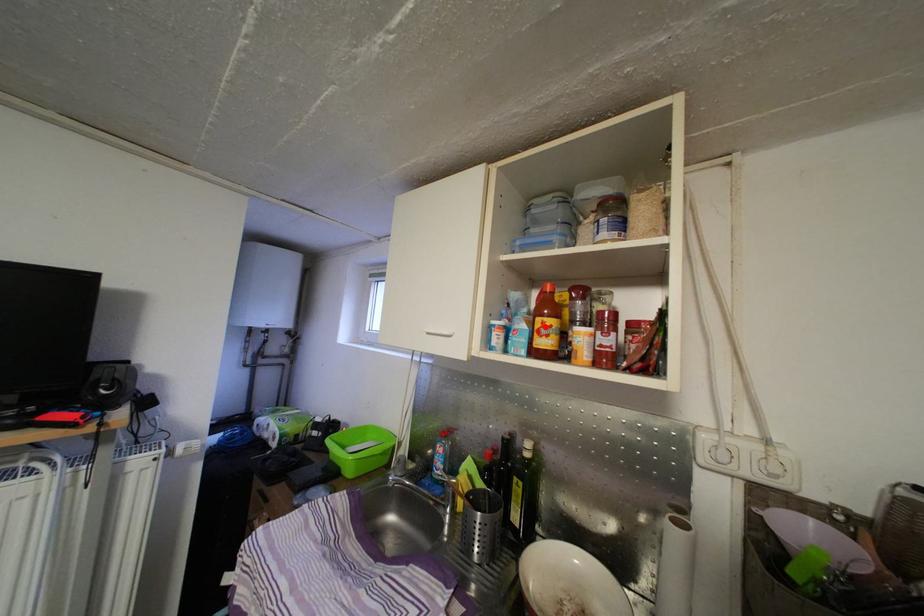
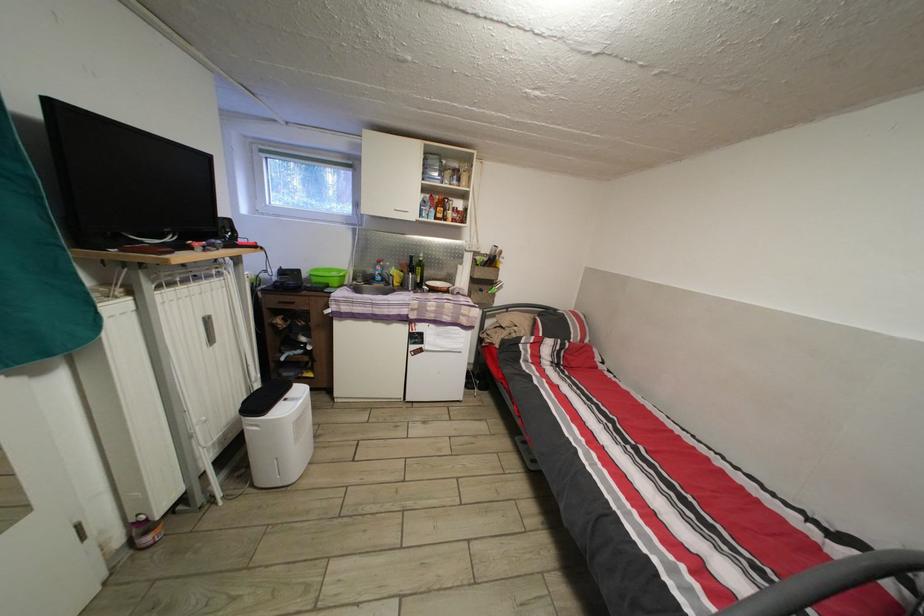
Where in the second image is the point corresponding to the highlighted location from the first image?

(445, 215)